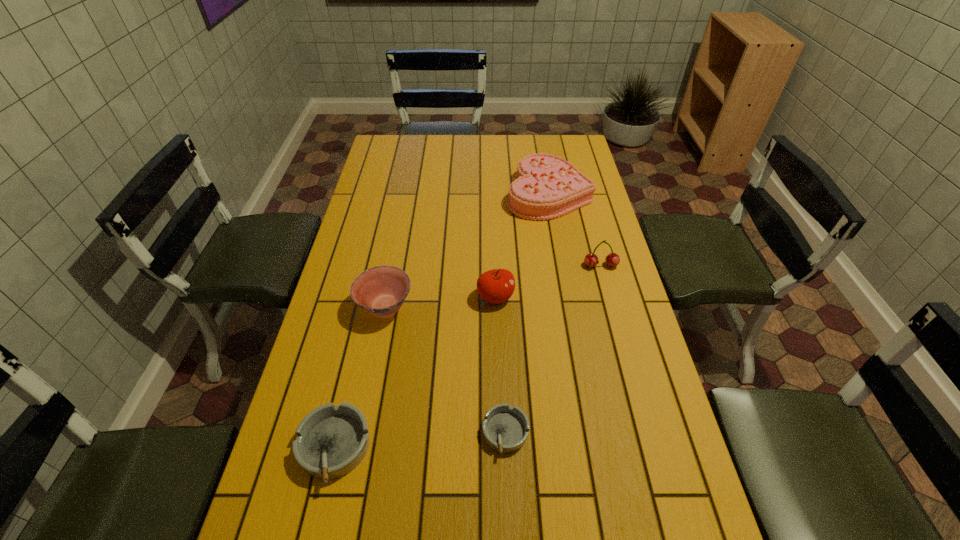
This screenshot has width=960, height=540. Find the location of `vacant point located on the front of the farthest object`. vacant point located on the front of the farthest object is located at coordinates (569, 305).

Where is `free space located 0.370m with stems pointing upwards on the second farthest object`? The image size is (960, 540). free space located 0.370m with stems pointing upwards on the second farthest object is located at coordinates (629, 372).

Identify the location of vacant point located 0.260m on the right of the bowl. (502, 307).

What are the coordinates of `blank space located on the left of the apple` in the screenshot? It's located at (417, 297).

At what (x,y) coordinates should I click in order to perform the action: click on ashtray at the left edge. Please return your answer as a coordinate pair (x, y). This screenshot has width=960, height=540. Looking at the image, I should click on (331, 441).

Identify the location of bowl located at the left edge. This screenshot has width=960, height=540. (381, 290).

Locate an element on the screen. The image size is (960, 540). cake that is at the right edge is located at coordinates (547, 186).

This screenshot has width=960, height=540. In order to click on cherry that is at the right edge in this screenshot , I will do `click(591, 260)`.

Where is `free space at the far edge of the desktop`? free space at the far edge of the desktop is located at coordinates (528, 135).

In the image, there is a desktop. Find the location of `free space at the near edge`. free space at the near edge is located at coordinates (541, 536).